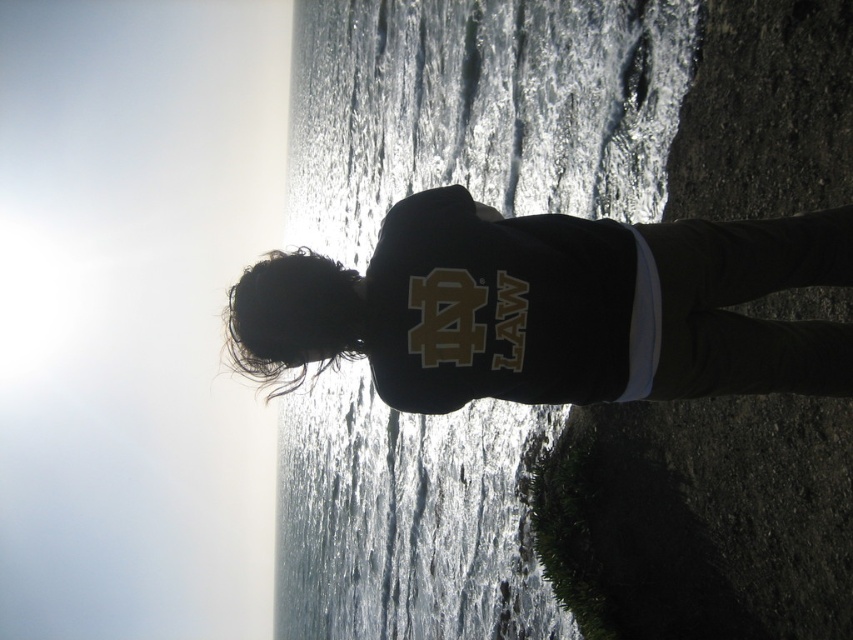
Which is behind, point (343, 51) or point (474, 243)?

The point (343, 51) is more distant.

Does point (344, 477) come farther from viewer compared to point (527, 268)?

That is True.

Is point (548, 147) positioned before point (467, 330)?

No, (548, 147) is further to viewer.

Image resolution: width=853 pixels, height=640 pixels. I want to click on glistening water at center, so click(x=480, y=108).